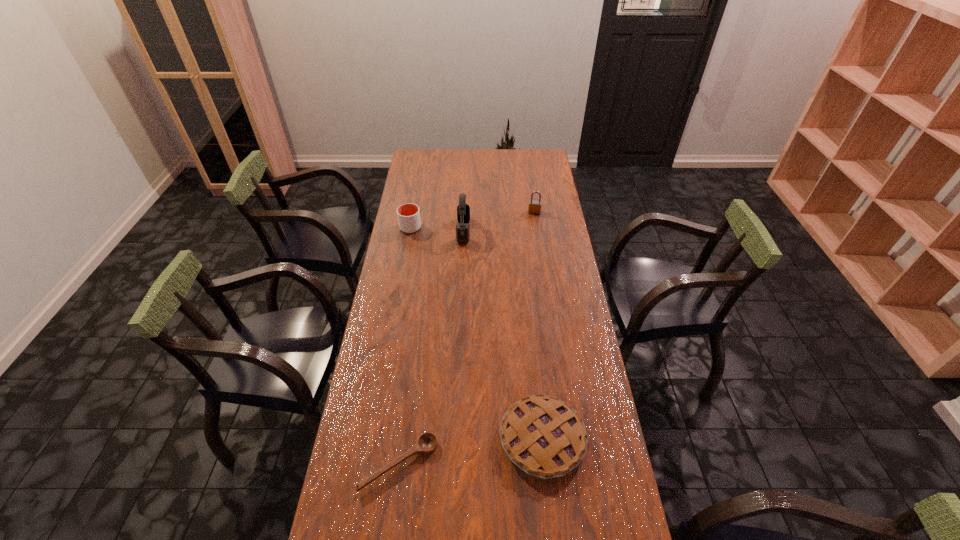
The height and width of the screenshot is (540, 960). What are the coordinates of `empty space between the padlock and the wooden spoon` in the screenshot? It's located at (467, 338).

You are a GUI agent. You are given a task and a screenshot of the screen. Output one action in this format:
    pyautogui.click(x=<x>, y=<y>)
    Task: Click on the empty space between the third tallest object and the third object from left to right
    This screenshot has width=960, height=540.
    Given the screenshot: What is the action you would take?
    pyautogui.click(x=437, y=229)

The image size is (960, 540). Find the location of `free spot between the shortest object and the cup`. free spot between the shortest object and the cup is located at coordinates (404, 346).

Identify the location of vacant area that lies between the wooden spoon and the headset. The height and width of the screenshot is (540, 960). pyautogui.click(x=431, y=348).

Find the location of `blank region between the fourth shortest object and the cup`. blank region between the fourth shortest object and the cup is located at coordinates (472, 220).

The image size is (960, 540). Find the location of `vacant region between the shortest object and the third object from right to left`. vacant region between the shortest object and the third object from right to left is located at coordinates (431, 348).

Find the location of a particular element. The image size is (960, 540). free space between the third shortest object and the second tallest object is located at coordinates (472, 220).

Find the location of a particular element. vacant area that lies between the third tallest object and the fourth shortest object is located at coordinates (472, 220).

Locate which object is the fourth closest to the headset. Please provide its 2D coordinates. Your answer should be formatted as a tuple, i.e. [(x, y)], where the tuple contains the x and y coordinates of a point satisfying the conditions above.

[(426, 444)]

Find the location of a particular element. object that stands as the closest to the fourth tallest object is located at coordinates (426, 444).